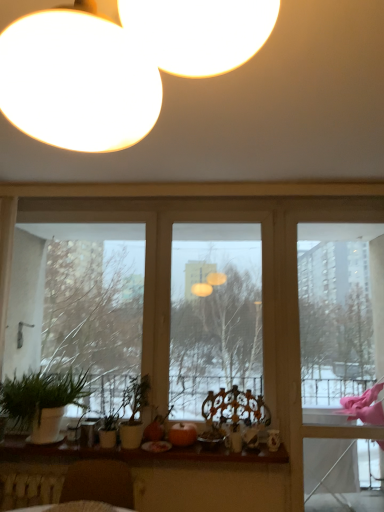
Question: Considering the relative positions of wooden at lower center and pink fabric at right in the image provided, is wooden at lower center to the left or to the right of pink fabric at right?

Choices:
 (A) left
 (B) right

Answer: (A)

Question: From the image's perspective, relative to pink fabric at right, is wooden at lower center above or below?

Choices:
 (A) below
 (B) above

Answer: (A)

Question: Which is nearer to the wooden at lower center?

Choices:
 (A) pink fabric at right
 (B) green matte plant at lower left
 (C) brown leather swivel chair at lower left
 (D) green matte plant at lower left, the 2th houseplant from the right
 (E) green matte plant at center, which ranks as the first houseplant in right-to-left order

Answer: (C)

Question: Considering the real-world distances, which object is farthest from the brown leather swivel chair at lower left?

Choices:
 (A) wooden round table at lower left
 (B) green matte plant at lower left
 (C) green matte plant at center, which ranks as the first houseplant in right-to-left order
 (D) pink fabric at right
 (E) wooden at lower center

Answer: (D)